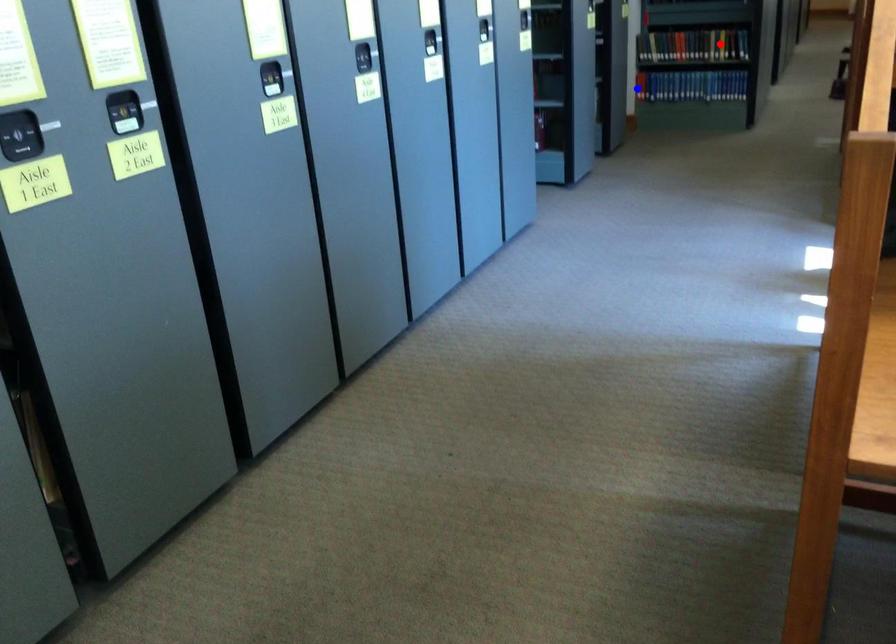
Question: Which of the two points in the image is closer to the camera?

Choices:
 (A) Blue point is closer.
 (B) Red point is closer.

Answer: (B)